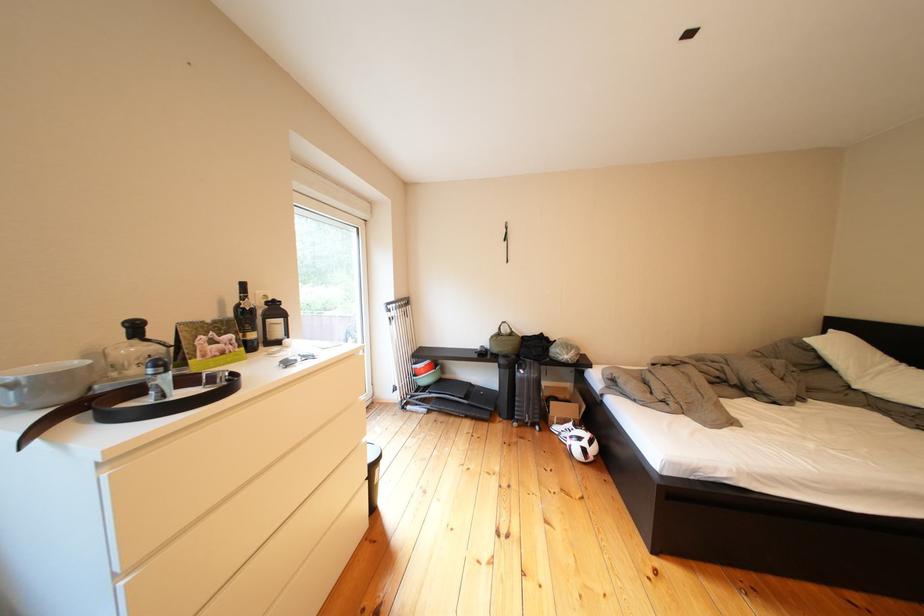
Identify the location of green tote bag. The image size is (924, 616). pos(504,341).